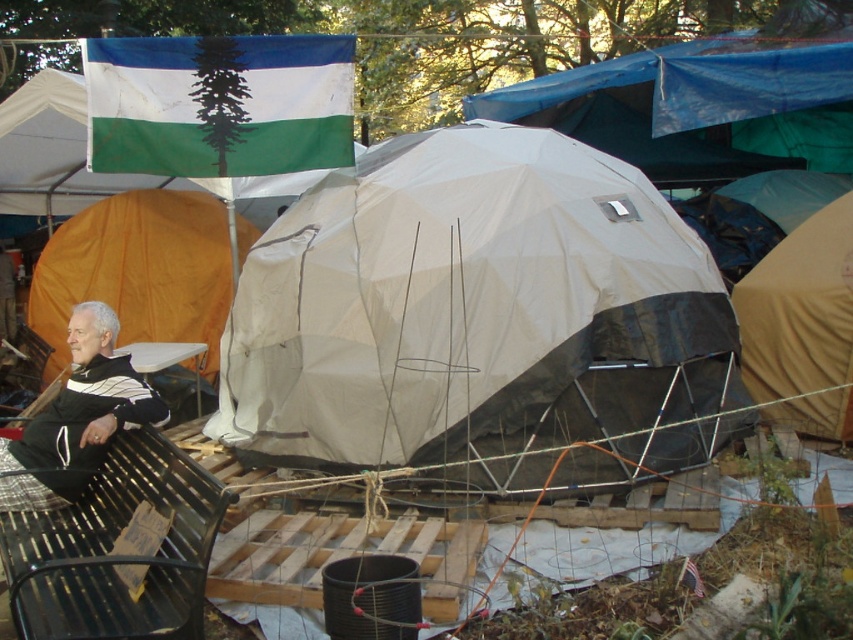
Between white tarpaulin tent at center and black metal park bench at lower left, which one appears on the right side from the viewer's perspective?

Positioned to the right is white tarpaulin tent at center.

Is white tarpaulin tent at center to the right of black metal park bench at lower left from the viewer's perspective?

Indeed, white tarpaulin tent at center is positioned on the right side of black metal park bench at lower left.

This screenshot has height=640, width=853. Identify the location of white tarpaulin tent at center. (480, 321).

Does beige fabric tent at right appear on the left side of dark gray sweater at left?

Incorrect, beige fabric tent at right is not on the left side of dark gray sweater at left.

Is beige fabric tent at right taller than dark gray sweater at left?

Yes.

This screenshot has height=640, width=853. In order to click on beige fabric tent at right in this screenshot , I will do `click(801, 326)`.

Can you confirm if white tarpaulin tent at center is taller than matte white tent at center?

Indeed, white tarpaulin tent at center has a greater height compared to matte white tent at center.

Consider the image. Is white tarpaulin tent at center shorter than matte white tent at center?

In fact, white tarpaulin tent at center may be taller than matte white tent at center.

What do you see at coordinates (480, 321) in the screenshot? I see `white tarpaulin tent at center` at bounding box center [480, 321].

Find the location of a particular element. The image size is (853, 640). white tarpaulin tent at center is located at coordinates (480, 321).